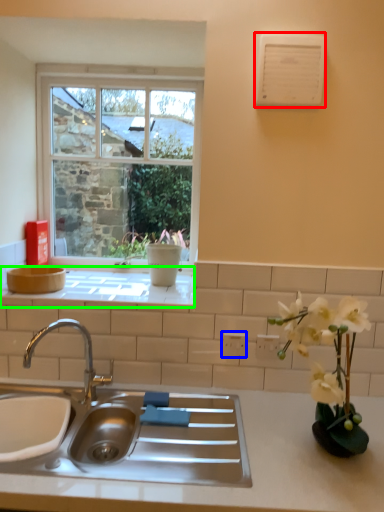
Question: Based on their relative distances, which object is nearer to air conditioner (highlighted by a red box)? Choose from electric outlet (highlighted by a blue box) and window sill (highlighted by a green box).

Choices:
 (A) electric outlet
 (B) window sill

Answer: (B)